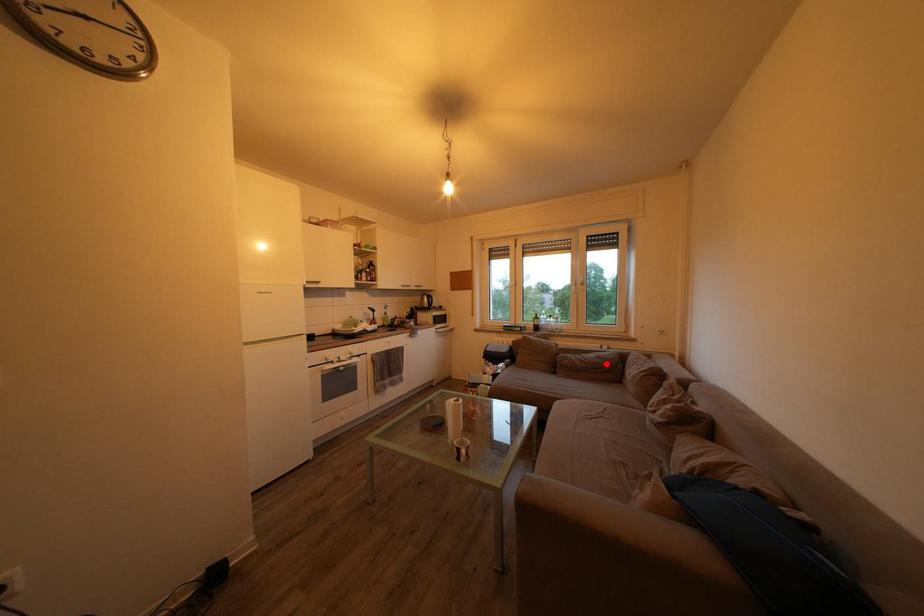
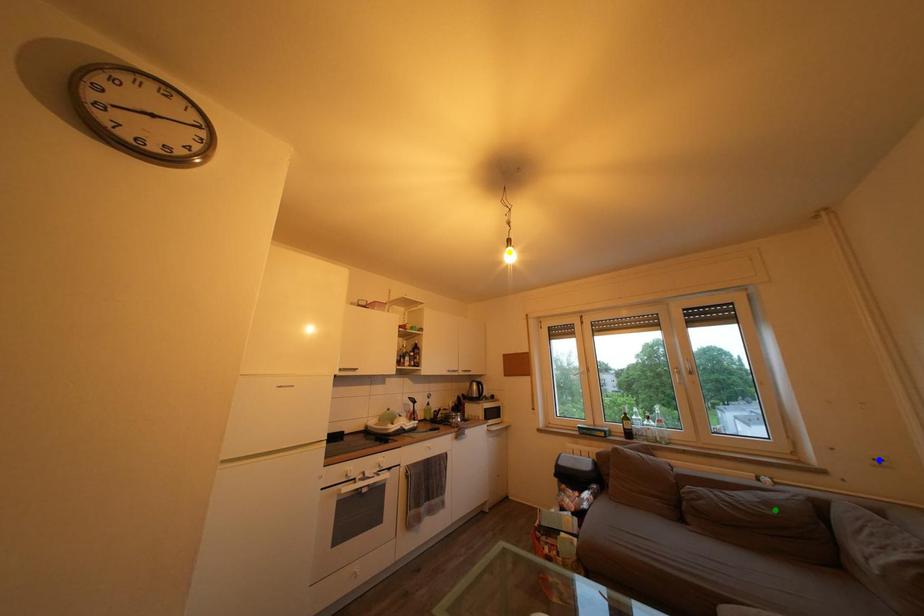
Question: I am providing you with two images of the same scene from different viewpoints. A red point is marked on the first image. You are given multiple points on the second image. Which point in image 2 represents the same 3d spot as the red point in image 1?

Choices:
 (A) blue point
 (B) yellow point
 (C) green point

Answer: (C)